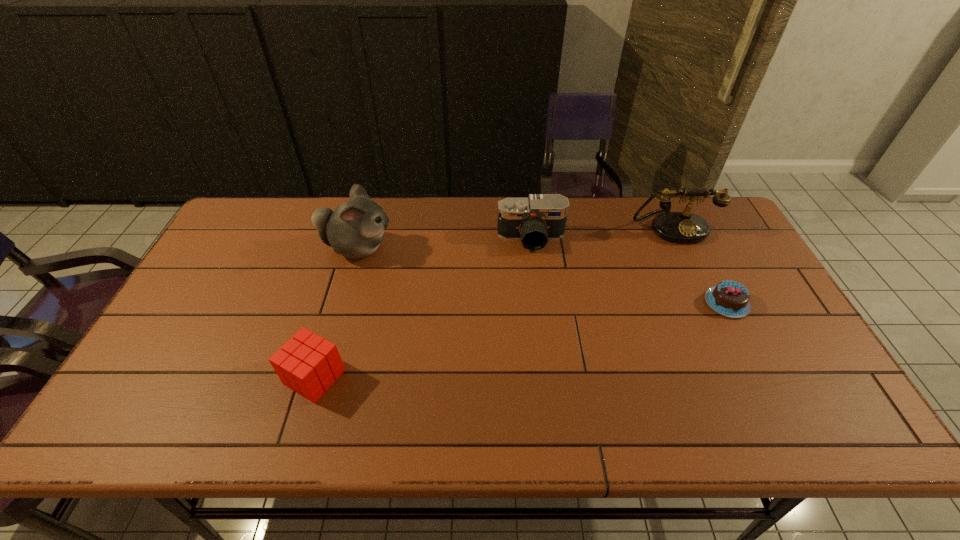
Identify the location of vacant position located 0.190m on the front-facing side of the third shortest object. Image resolution: width=960 pixels, height=540 pixels. (539, 299).

Locate an element on the screen. This screenshot has width=960, height=540. vacant space located on the back of the second shortest object is located at coordinates (339, 296).

Find the location of a particular element. Image resolution: width=960 pixels, height=540 pixels. vacant space situated on the left of the shortest object is located at coordinates (637, 303).

At what (x,y) coordinates should I click in order to perform the action: click on hamster positioned at the far edge. Please return your answer as a coordinate pair (x, y). Looking at the image, I should click on (354, 229).

The image size is (960, 540). In order to click on telephone positioned at the far edge in this screenshot , I will do `click(678, 227)`.

At what (x,y) coordinates should I click in order to perform the action: click on camera present at the far edge. Please return your answer as a coordinate pair (x, y). This screenshot has height=540, width=960. Looking at the image, I should click on (534, 220).

I want to click on telephone that is at the right edge, so click(678, 227).

Locate an element on the screen. This screenshot has height=540, width=960. chocolate cake positioned at the right edge is located at coordinates coord(731,299).

Image resolution: width=960 pixels, height=540 pixels. Identify the location of object that is positioned at the far right corner. (678, 227).

At what (x,y) coordinates should I click in order to perform the action: click on blank space at the far edge of the desktop. Please return your answer as a coordinate pair (x, y). This screenshot has height=540, width=960. Looking at the image, I should click on (617, 216).